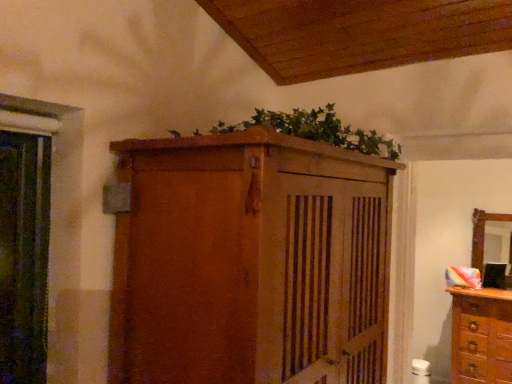
This screenshot has width=512, height=384. What do you see at coordinates (481, 336) in the screenshot?
I see `wooden dresser at right` at bounding box center [481, 336].

Where is `wooden mirror at right`? The height and width of the screenshot is (384, 512). wooden mirror at right is located at coordinates (483, 234).

What is the approximate height of green leafy plant at upper center?

5.88 inches.

In order to click on matte wooden cupboard at upper center in this screenshot , I will do `click(250, 261)`.

From the image's perspective, is matte wooden cupboard at upper center under wooden mirror at right?

No, from the image's perspective, matte wooden cupboard at upper center is not below wooden mirror at right.

Measure the distance from matte wooden cupboard at upper center to wooden mirror at right.

3.08 meters.

Does matte wooden cupboard at upper center touch wooden mirror at right?

No, matte wooden cupboard at upper center is not touching wooden mirror at right.

Which is less distant, (x=315, y=153) or (x=476, y=224)?

Point (x=315, y=153) appears to be closer to the viewer than point (x=476, y=224).

Which object is more forward, green leafy plant at upper center or wooden mirror at right?

Positioned in front is green leafy plant at upper center.

Looking at this image, from a real-world perspective, who is located lower, green leafy plant at upper center or wooden mirror at right?

wooden mirror at right.

The width and height of the screenshot is (512, 384). What are the coordinates of `mirror that is under the green leafy plant at upper center (from a real-world perspective)` in the screenshot? It's located at (483, 234).

How different are the orientations of green leafy plant at upper center and wooden mirror at right in degrees?

The angle between the facing direction of green leafy plant at upper center and the facing direction of wooden mirror at right is 91.7 degrees.

Can green leafy plant at upper center be found inside wooden mirror at right?

Actually, green leafy plant at upper center is outside wooden mirror at right.

Is green leafy plant at upper center at the back of wooden mirror at right?

wooden mirror at right is not turned away from green leafy plant at upper center.

Which of these two, wooden mirror at right or green leafy plant at upper center, is bigger?

green leafy plant at upper center is bigger.

Can you see wooden mirror at right touching wooden dresser at right?

wooden mirror at right is not next to wooden dresser at right, and they're not touching.

Based on the photo, which is more to the right, wooden mirror at right or wooden dresser at right?

wooden mirror at right.

Could you tell me if wooden mirror at right is facing wooden dresser at right?

No.

From the image's perspective, which is above, wooden mirror at right or wooden dresser at right?

wooden mirror at right, from the image's perspective.

From the image's perspective, which one is positioned higher, matte wooden cupboard at upper center or wooden dresser at right?

matte wooden cupboard at upper center appears higher in the image.

Is there a large distance between matte wooden cupboard at upper center and wooden dresser at right?

matte wooden cupboard at upper center is positioned a significant distance from wooden dresser at right.

Between matte wooden cupboard at upper center and wooden dresser at right, which one has more height?

With more height is matte wooden cupboard at upper center.

From a real-world perspective, which object rests below the other?

In real-world perspective, wooden dresser at right is lower.

Which object is closer to the camera taking this photo, wooden dresser at right or matte wooden cupboard at upper center?

matte wooden cupboard at upper center.

Can you tell me how much wooden dresser at right and matte wooden cupboard at upper center differ in facing direction?

They differ by 90 degrees in their facing directions.

Considering the positions of points (487, 356) and (478, 248), is point (487, 356) farther from camera compared to point (478, 248)?

No, (487, 356) is in front of (478, 248).

Is wooden dresser at right oriented towards wooden mirror at right?

No, wooden dresser at right does not turn towards wooden mirror at right.

From the image's perspective, is wooden dresser at right above or below wooden mirror at right?

Based on their image positions, wooden dresser at right is located beneath wooden mirror at right.

Find the location of `cupboard above the wooden mirror at right (from the image's perspective)`. cupboard above the wooden mirror at right (from the image's perspective) is located at coordinates (250, 261).

This screenshot has width=512, height=384. I want to click on mirror lying behind the green leafy plant at upper center, so click(x=483, y=234).

Which object lies further to the anchor point green leafy plant at upper center, matte wooden cupboard at upper center or wooden mirror at right?

Among the two, wooden mirror at right is located further to green leafy plant at upper center.

When comparing their distances from matte wooden cupboard at upper center, does green leafy plant at upper center or wooden dresser at right seem further?

wooden dresser at right is positioned further to the anchor matte wooden cupboard at upper center.

Considering their positions, is wooden mirror at right positioned further to green leafy plant at upper center than matte wooden cupboard at upper center?

Based on the image, wooden mirror at right appears to be further to green leafy plant at upper center.

Looking at the image, which one is located closer to matte wooden cupboard at upper center, green leafy plant at upper center or wooden mirror at right?

Among the two, green leafy plant at upper center is located nearer to matte wooden cupboard at upper center.

Estimate the real-world distances between objects in this image. Which object is further from wooden dresser at right, wooden mirror at right or green leafy plant at upper center?

The object further to wooden dresser at right is green leafy plant at upper center.

From the image, which object appears to be nearer to green leafy plant at upper center, wooden dresser at right or matte wooden cupboard at upper center?

Among the two, matte wooden cupboard at upper center is located nearer to green leafy plant at upper center.

Estimate the real-world distances between objects in this image. Which object is further from wooden mirror at right, wooden dresser at right or green leafy plant at upper center?

The object further to wooden mirror at right is green leafy plant at upper center.

From the image, which object appears to be farther from wooden dresser at right, matte wooden cupboard at upper center or green leafy plant at upper center?

Among the two, matte wooden cupboard at upper center is located further to wooden dresser at right.

At what (x,y) coordinates should I click in order to perform the action: click on plant between matte wooden cupboard at upper center and wooden mirror at right in the front-back direction. Please return your answer as a coordinate pair (x, y). Looking at the image, I should click on (317, 130).

The image size is (512, 384). In order to click on plant positioned between matte wooden cupboard at upper center and wooden dresser at right from near to far in this screenshot , I will do point(317,130).

This screenshot has width=512, height=384. What are the coordinates of `chest of drawers between matte wooden cupboard at upper center and wooden mirror at right along the z-axis` in the screenshot? It's located at (481, 336).

The height and width of the screenshot is (384, 512). What are the coordinates of `chest of drawers between green leafy plant at upper center and wooden mirror at right from front to back` in the screenshot? It's located at (481, 336).